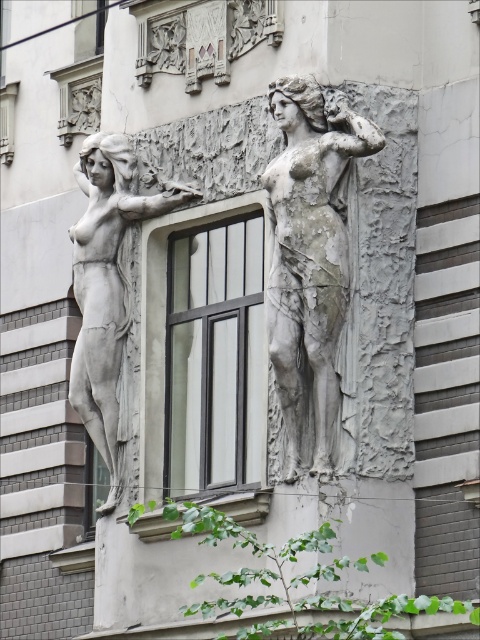
Is point (210, 397) farther from camera compared to point (292, 422)?

Yes, it is.

Can you confirm if black glass window at center is positioned below stone statue at center?

Correct, black glass window at center is located below stone statue at center.

Does point (177, 272) come farther from viewer compared to point (331, 424)?

That is True.

This screenshot has height=640, width=480. Identify the location of black glass window at center. (204, 353).

Can you confirm if black glass window at center is positioned below matte gray statue at left?

Indeed, black glass window at center is positioned under matte gray statue at left.

Is point (203, 401) positioned after point (170, 192)?

No, (203, 401) is in front of (170, 192).

Identify the location of black glass window at center. (204, 353).

Can you confirm if stone statue at center is positioned below matte gray statue at left?

Correct, stone statue at center is located below matte gray statue at left.

Between stone statue at center and matte gray statue at left, which one appears on the left side from the viewer's perspective?

From the viewer's perspective, matte gray statue at left appears more on the left side.

Measure the distance between stone statue at center and camera.

A distance of 226.56 feet exists between stone statue at center and camera.

This screenshot has height=640, width=480. What are the coordinates of `stone statue at center` in the screenshot? It's located at (310, 259).